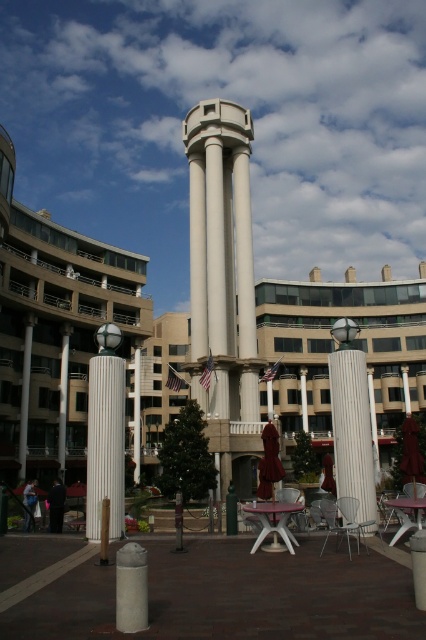
Question: Which of these objects is positioned farthest from the blue fabric monk at lower left?

Choices:
 (A) black velvet monk at lower left
 (B) white plastic chair at lower right
 (C) white concrete tower at center
 (D) metallic silver chair at lower right

Answer: (C)

Question: Is gray concrete pillar at lower left in front of white plastic chair at lower right?

Choices:
 (A) no
 (B) yes

Answer: (B)

Question: Which point is closer to the camera?

Choices:
 (A) (276, 461)
 (B) (347, 529)
 (C) (337, 397)

Answer: (B)

Question: Can you confirm if white plastic chair at lower right is thinner than metallic silver chair at lower right?

Choices:
 (A) no
 (B) yes

Answer: (B)

Question: Does white plastic chair at lower right lie behind metallic silver chair at lower right?

Choices:
 (A) no
 (B) yes

Answer: (B)

Question: Which object appears closest to the camera in this image?

Choices:
 (A) white concrete tower at center
 (B) white plastic chair at lower right
 (C) blue fabric monk at lower left

Answer: (B)